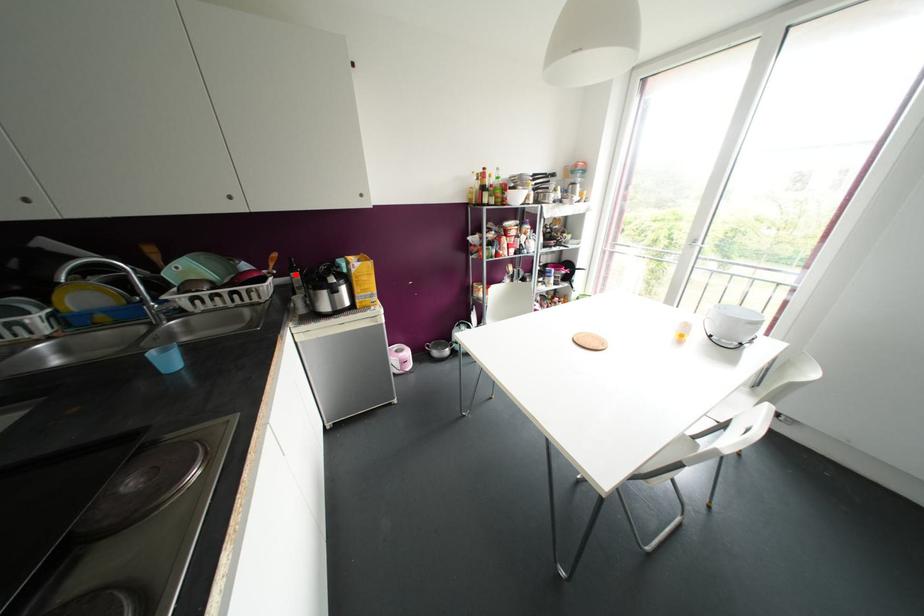
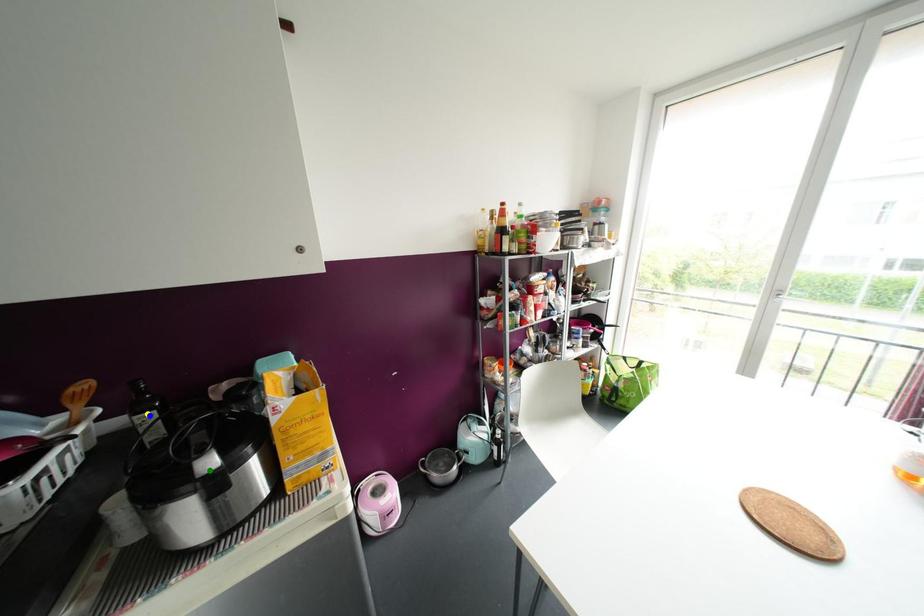
Question: I am providing you with two images of the same scene from different viewpoints. A red point is marked on the first image. You are given multiple points on the second image. Which mark in image 2 goes with the point in image 1?

Choices:
 (A) yellow point
 (B) green point
 (C) blue point

Answer: (C)